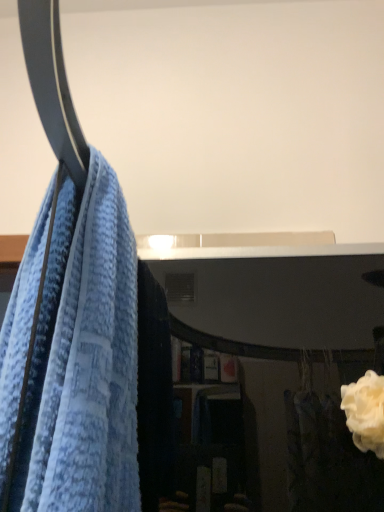
Question: Is the depth of white matte rose at lower right less than that of blue textured towel at left?

Choices:
 (A) yes
 (B) no

Answer: (B)

Question: Could blue textured towel at left be considered to be inside white matte rose at lower right?

Choices:
 (A) no
 (B) yes

Answer: (A)

Question: Is white matte rose at lower right oriented towards blue textured towel at left?

Choices:
 (A) no
 (B) yes

Answer: (A)

Question: Is white matte rose at lower right at the left side of blue textured towel at left?

Choices:
 (A) no
 (B) yes

Answer: (A)

Question: Can you confirm if white matte rose at lower right is wider than blue textured towel at left?

Choices:
 (A) no
 (B) yes

Answer: (A)

Question: Can you confirm if white matte rose at lower right is smaller than blue textured towel at left?

Choices:
 (A) yes
 (B) no

Answer: (A)

Question: Does blue textured towel at left have a greater height compared to white matte rose at lower right?

Choices:
 (A) yes
 (B) no

Answer: (A)

Question: Is blue textured towel at left wider than white matte rose at lower right?

Choices:
 (A) no
 (B) yes

Answer: (B)

Question: Is blue textured towel at left to the right of white matte rose at lower right from the viewer's perspective?

Choices:
 (A) no
 (B) yes

Answer: (A)

Question: Can white matte rose at lower right be found inside blue textured towel at left?

Choices:
 (A) no
 (B) yes

Answer: (A)

Question: Is the depth of blue textured towel at left greater than that of white matte rose at lower right?

Choices:
 (A) yes
 (B) no

Answer: (B)

Question: From the image's perspective, does blue textured towel at left appear higher than white matte rose at lower right?

Choices:
 (A) no
 (B) yes

Answer: (B)

Question: Based on their sizes in the image, would you say blue textured towel at left is bigger or smaller than white matte rose at lower right?

Choices:
 (A) small
 (B) big

Answer: (B)